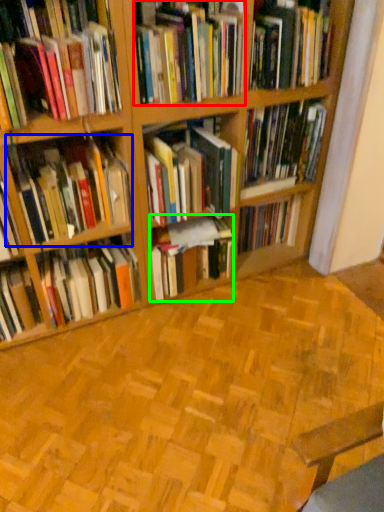
Question: Which is nearer to the book (highlighted by a red box)? book (highlighted by a blue box) or book (highlighted by a green box).

Choices:
 (A) book
 (B) book

Answer: (A)